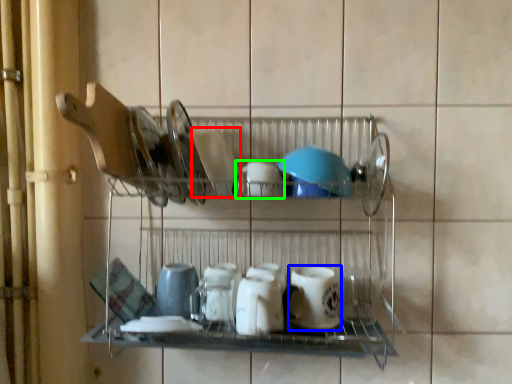
Question: Which object is the farthest from tableware (highlighted by a red box)? Choose among these: tableware (highlighted by a blue box) or tableware (highlighted by a green box).

Choices:
 (A) tableware
 (B) tableware

Answer: (A)